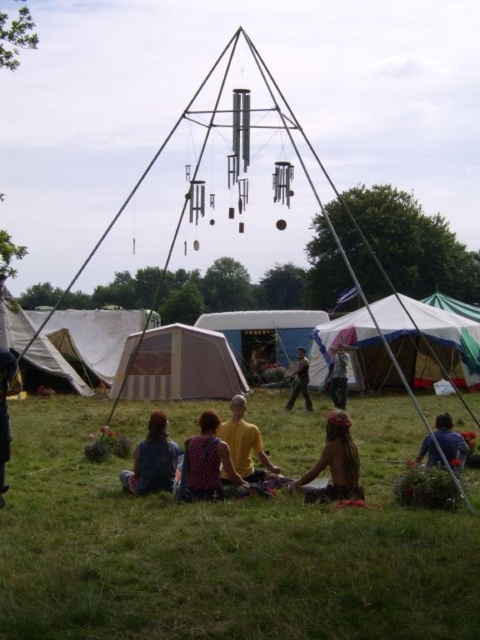
You are standing in the festival area and want to reach the dark blue fabric at lower left. Which direction should you move from the blue fabric at lower right to get there?

Since the blue fabric at lower right is closer to you than the dark blue fabric at lower left, you should move backward away from the blue fabric at lower right to reach the dark blue fabric at lower left.

You are organizing a festival and need to place a large banner between the yellow cotton shirt at center and the dark blue fabric at lower left. Which object should the banner be placed closer to if you want it to be more noticeable?

The banner should be placed closer to the yellow cotton shirt at center because it is smaller than the dark blue fabric at lower left, making it more likely to draw attention when the banner is near it.

You are setting up a picnic blanket and need to choose between the blue fabric at lower right and the dark blue fabric at lower left. Which one is taller?

The dark blue fabric at lower left is taller than the blue fabric at lower right.